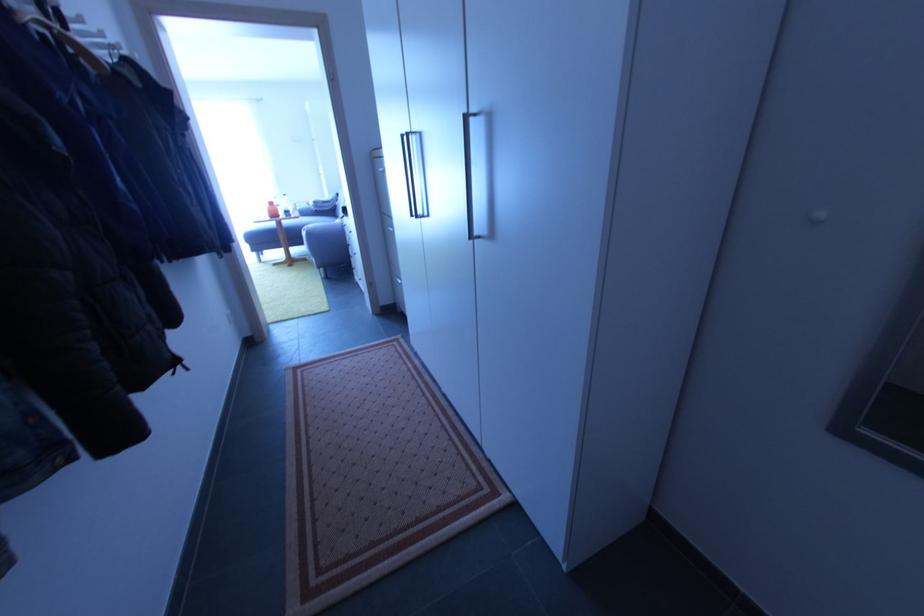
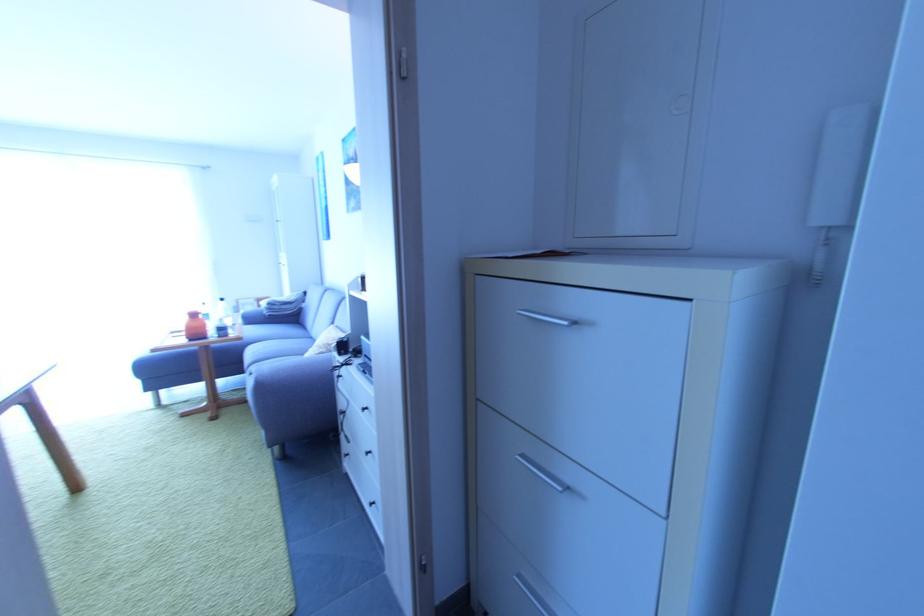
The images are taken continuously from a first-person perspective. In which direction are you moving?

The cameraman moved toward left, forward.